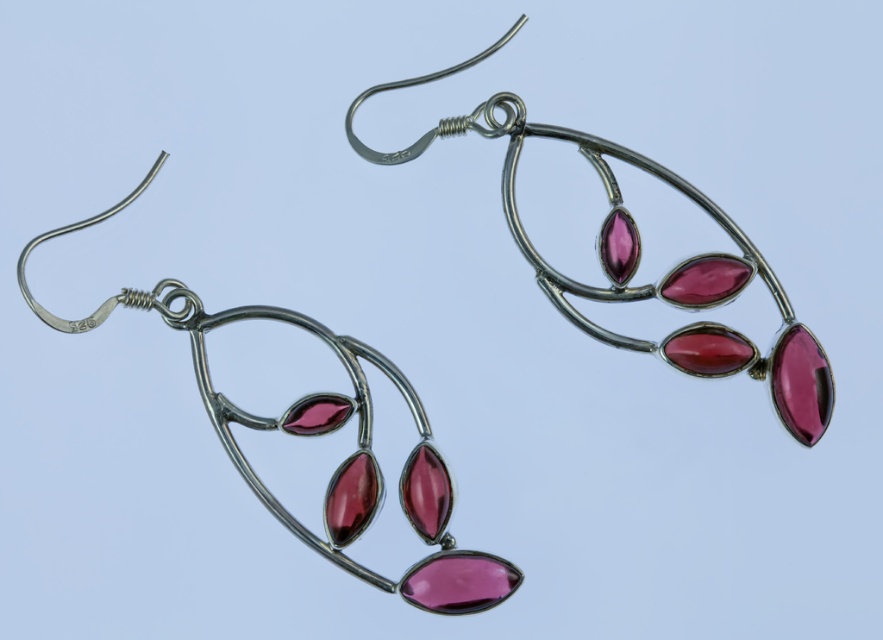
Where is `matte silver earrings at center`? matte silver earrings at center is located at coordinates click(x=639, y=259).

Who is positioned more to the right, matte silver earrings at center or matte silver earrings at left?

matte silver earrings at center is more to the right.

Locate an element on the screen. The image size is (883, 640). matte silver earrings at center is located at coordinates (639, 259).